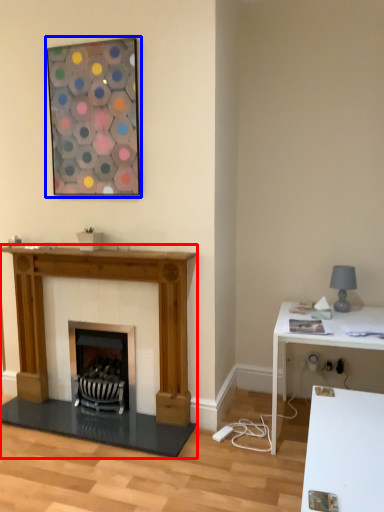
Question: Which point is further to the camera, fireplace (highlighted by a red box) or picture frame (highlighted by a blue box)?

Choices:
 (A) fireplace
 (B) picture frame

Answer: (A)